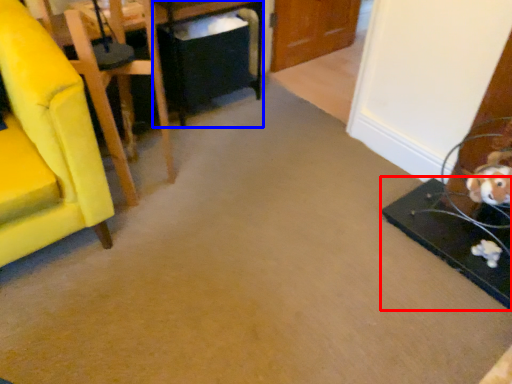
Question: Which point is closer to the camera, table (highlighted by a red box) or table (highlighted by a blue box)?

Choices:
 (A) table
 (B) table

Answer: (A)